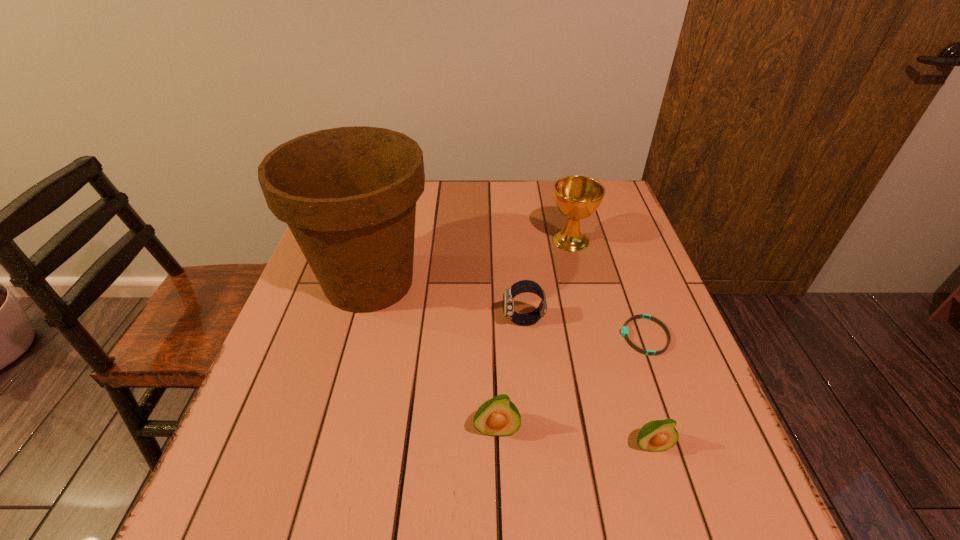
The height and width of the screenshot is (540, 960). What are the coordinates of `blank space at the far edge of the desktop` in the screenshot? It's located at (493, 203).

Where is `vacant region at the near edge of the desktop`? Image resolution: width=960 pixels, height=540 pixels. vacant region at the near edge of the desktop is located at coordinates (344, 425).

In the image, there is a desktop. Identify the location of vacant area at the left edge. This screenshot has width=960, height=540. 276,377.

In the image, there is a desktop. Where is `blank space at the right edge`? Image resolution: width=960 pixels, height=540 pixels. blank space at the right edge is located at coordinates (636, 238).

Identify the location of empty space between the shortest object and the watch. (584, 329).

Where is `free spot between the shorter avocado and the second tallest object`? The width and height of the screenshot is (960, 540). free spot between the shorter avocado and the second tallest object is located at coordinates (611, 343).

Where is `free space between the second tallest object and the leftmost object`? The height and width of the screenshot is (540, 960). free space between the second tallest object and the leftmost object is located at coordinates (470, 261).

This screenshot has width=960, height=540. I want to click on empty location between the chalice and the watch, so click(547, 281).

This screenshot has height=540, width=960. In order to click on free space between the chalice and the left avocado in this screenshot , I will do `click(534, 335)`.

Image resolution: width=960 pixels, height=540 pixels. I want to click on vacant area that lies between the chalice and the right avocado, so click(611, 343).